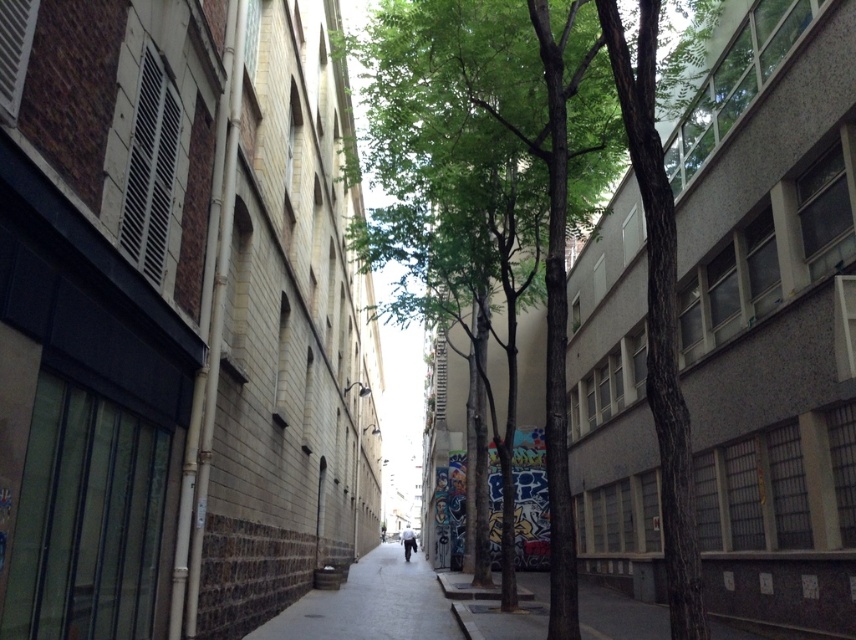
Question: Which is nearer to the gray concrete sidewalk at center?

Choices:
 (A) green rough bark tree at center
 (B) white fabric pants at center

Answer: (A)

Question: Does green rough bark tree at center have a lesser width compared to white fabric pants at center?

Choices:
 (A) yes
 (B) no

Answer: (B)

Question: Which point is closer to the camera?

Choices:
 (A) gray concrete sidewalk at center
 (B) green rough bark tree at center

Answer: (B)

Question: Which of the following is the closest to the observer?

Choices:
 (A) (367, 566)
 (B) (432, 10)
 (C) (412, 552)

Answer: (B)

Question: Can you confirm if gray concrete sidewalk at center is positioned below white fabric pants at center?

Choices:
 (A) yes
 (B) no

Answer: (B)

Question: Is green rough bark tree at center in front of gray concrete sidewalk at center?

Choices:
 (A) yes
 (B) no

Answer: (A)